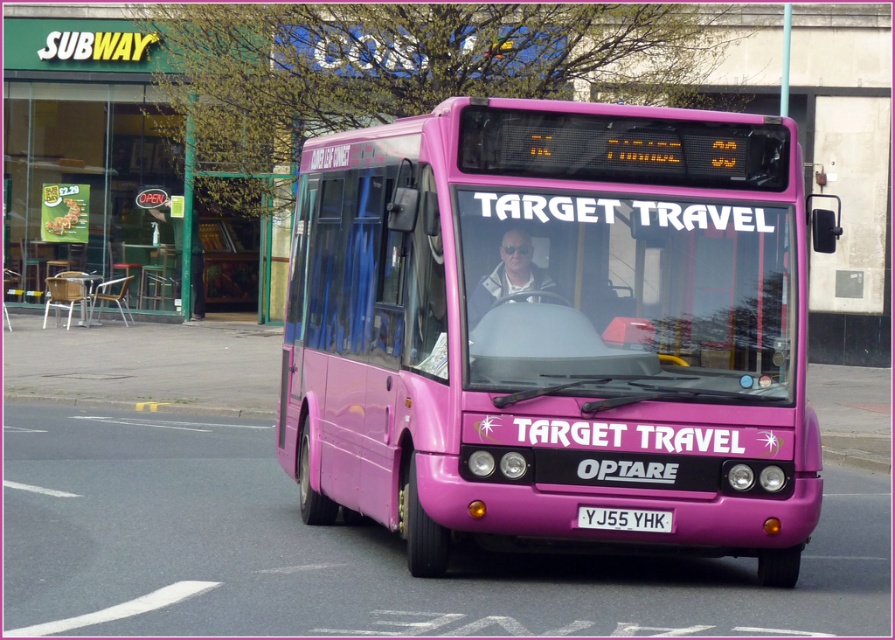
Can you confirm if matte pink bus at center is taller than white plastic license plate at center?

Indeed, matte pink bus at center has a greater height compared to white plastic license plate at center.

Is matte pink bus at center to the left of white plastic license plate at center from the viewer's perspective?

Correct, you'll find matte pink bus at center to the left of white plastic license plate at center.

The height and width of the screenshot is (640, 895). I want to click on matte pink bus at center, so click(556, 330).

The image size is (895, 640). I want to click on matte pink bus at center, so click(556, 330).

Is point (529, 292) behind point (609, 508)?

Yes, point (529, 292) is behind point (609, 508).

Does matte black sunglasses at center appear on the right side of white plastic license plate at center?

No, matte black sunglasses at center is not to the right of white plastic license plate at center.

Identify the location of matte black sunglasses at center. [x=510, y=278].

Is matte pink bus at center below matte black sunglasses at center?

Yes, matte pink bus at center is below matte black sunglasses at center.

Who is more distant from viewer, [604,289] or [501,273]?

The point [604,289] is more distant.

Which is behind, point (825, 196) or point (469, 324)?

The point (825, 196) is more distant.

Find the location of a particular element. matte pink bus at center is located at coordinates (556, 330).